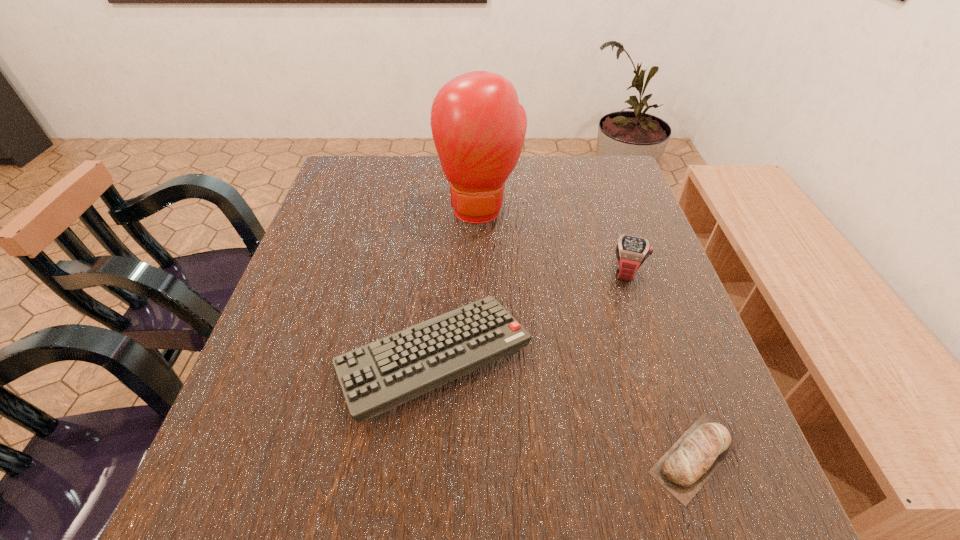
The image size is (960, 540). In order to click on object situated at the far edge in this screenshot , I will do `click(478, 126)`.

The image size is (960, 540). Find the location of `object that is at the near edge`. object that is at the near edge is located at coordinates (690, 462).

Identify the location of object that is at the left edge. (376, 377).

The width and height of the screenshot is (960, 540). I want to click on watch that is at the right edge, so click(x=631, y=252).

Locate an element on the screen. The image size is (960, 540). pita bread that is at the right edge is located at coordinates (690, 462).

Find the location of `object that is positioned at the near right corner`. object that is positioned at the near right corner is located at coordinates (690, 462).

Locate an element on the screen. The width and height of the screenshot is (960, 540). blank space at the far edge is located at coordinates (544, 170).

Locate an element on the screen. The width and height of the screenshot is (960, 540). vacant space at the left edge of the desktop is located at coordinates (377, 220).

This screenshot has width=960, height=540. In order to click on free region at the right edge in this screenshot , I will do `click(655, 352)`.

This screenshot has width=960, height=540. Identify the location of vacant space at the far left corner. (388, 164).